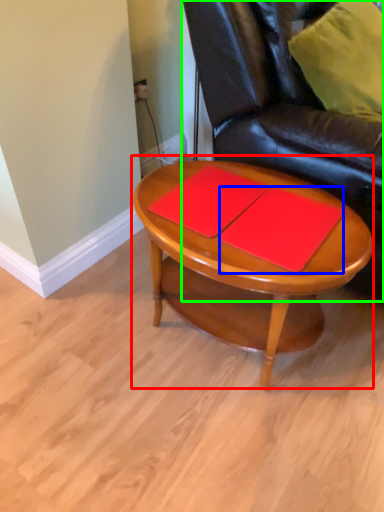
Question: Which object is the closest to the coffee table (highlighted by a red box)? Choose among these: notebook (highlighted by a blue box) or chair (highlighted by a green box).

Choices:
 (A) notebook
 (B) chair

Answer: (A)